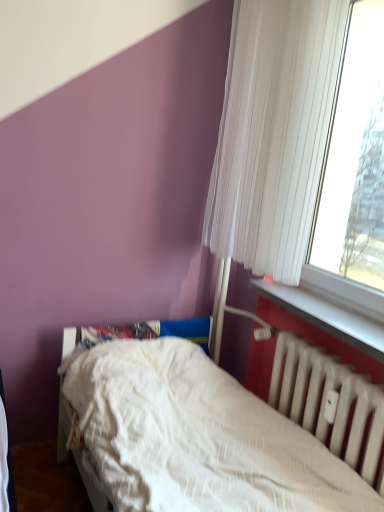
What do you see at coordinates (273, 132) in the screenshot? I see `white pleated curtain at upper right` at bounding box center [273, 132].

The image size is (384, 512). Describe the element at coordinates (221, 432) in the screenshot. I see `white textured bed at lower center` at that location.

This screenshot has height=512, width=384. What are the coordinates of `white pleated curtain at upper right` in the screenshot? It's located at (273, 132).

Consider the image. Does white plastic window sill at lower right have a larger size compared to white textured bed at lower center?

No, white plastic window sill at lower right is not bigger than white textured bed at lower center.

From a real-world perspective, is white plastic window sill at lower right over white textured bed at lower center?

Yes.

Between white plastic window sill at lower right and white textured bed at lower center, which one has smaller width?

With smaller width is white plastic window sill at lower right.

Considering the positions of point (355, 321) and point (235, 406), is point (355, 321) closer or farther from the camera than point (235, 406)?

Point (355, 321) is closer to the camera than point (235, 406).

From their relative heights in the image, would you say white pleated curtain at upper right is taller or shorter than white matte radiator at lower right?

white pleated curtain at upper right is taller than white matte radiator at lower right.

From the image's perspective, which is below, white pleated curtain at upper right or white matte radiator at lower right?

white matte radiator at lower right appears lower in the image.

Is white pleated curtain at upper right beside white matte radiator at lower right?

No, white pleated curtain at upper right is not next to white matte radiator at lower right.

Is white pleated curtain at upper right to the right of white matte radiator at lower right from the viewer's perspective?

No, white pleated curtain at upper right is not to the right of white matte radiator at lower right.

Does white matte radiator at lower right turn towards white textured bed at lower center?

Yes, white matte radiator at lower right is turned towards white textured bed at lower center.

Is point (275, 348) farther from camera compared to point (322, 455)?

Yes, point (275, 348) is behind point (322, 455).

Is white matte radiator at lower right to the left or to the right of white textured bed at lower center in the image?

white matte radiator at lower right is positioned on white textured bed at lower center's right side.

Considering the positions of point (179, 416) and point (269, 34), is point (179, 416) closer or farther from the camera than point (269, 34)?

Clearly, point (179, 416) is closer to the camera than point (269, 34).

Is white textured bed at lower center oriented towards white pleated curtain at upper right?

No.

Is white textured bed at lower center positioned behind white pleated curtain at upper right?

No, white textured bed at lower center is closer to the viewer.

From the image's perspective, which object appears higher, white textured bed at lower center or white pleated curtain at upper right?

white pleated curtain at upper right, from the image's perspective.

Who is more distant, white matte radiator at lower right or white pleated curtain at upper right?

white pleated curtain at upper right is more distant.

Is white matte radiator at lower right oriented towards white pleated curtain at upper right?

No.

From a real-world perspective, is white matte radiator at lower right beneath white pleated curtain at upper right?

Indeed, from a real-world perspective, white matte radiator at lower right is positioned beneath white pleated curtain at upper right.

Considering the sizes of objects white matte radiator at lower right and white pleated curtain at upper right in the image provided, who is taller, white matte radiator at lower right or white pleated curtain at upper right?

white pleated curtain at upper right.

Between white plastic window sill at lower right and white pleated curtain at upper right, which one has smaller width?

Thinner between the two is white plastic window sill at lower right.

Which object is more forward, white plastic window sill at lower right or white pleated curtain at upper right?

white plastic window sill at lower right is closer to the camera.

Could white pleated curtain at upper right be considered to be inside white plastic window sill at lower right?

No, white pleated curtain at upper right is not surrounded by white plastic window sill at lower right.

The image size is (384, 512). What are the coordinates of `curtain behind the white plastic window sill at lower right` in the screenshot? It's located at (273, 132).

Locate an element on the screen. This screenshot has height=512, width=384. radiator located underneath the white plastic window sill at lower right (from a real-world perspective) is located at coordinates (330, 403).

Are white plastic window sill at lower right and white matte radiator at lower right making contact?

white plastic window sill at lower right is not next to white matte radiator at lower right, and they're not touching.

Can you confirm if white plastic window sill at lower right is thinner than white matte radiator at lower right?

In fact, white plastic window sill at lower right might be wider than white matte radiator at lower right.

Consider the image. Is white plastic window sill at lower right to the right of white matte radiator at lower right from the viewer's perspective?

Yes, white plastic window sill at lower right is to the right of white matte radiator at lower right.

There is a white textured bed at lower center. Where is `window sill above it (from a real-world perspective)`? This screenshot has height=512, width=384. window sill above it (from a real-world perspective) is located at coordinates (326, 315).

Locate an element on the screen. radiator below the white pleated curtain at upper right (from the image's perspective) is located at coordinates (330, 403).

From the image, which object appears to be farther from white textured bed at lower center, white pleated curtain at upper right or white plastic window sill at lower right?

white pleated curtain at upper right is positioned further to the anchor white textured bed at lower center.

Estimate the real-world distances between objects in this image. Which object is further from white plastic window sill at lower right, white textured bed at lower center or white matte radiator at lower right?

Among the two, white textured bed at lower center is located further to white plastic window sill at lower right.

From the picture: When comparing their distances from white pleated curtain at upper right, does white plastic window sill at lower right or white matte radiator at lower right seem further?

Among the two, white matte radiator at lower right is located further to white pleated curtain at upper right.

Which object lies nearer to the anchor point white matte radiator at lower right, white textured bed at lower center or white pleated curtain at upper right?

Based on the image, white textured bed at lower center appears to be nearer to white matte radiator at lower right.

When comparing their distances from white textured bed at lower center, does white pleated curtain at upper right or white matte radiator at lower right seem further?

white pleated curtain at upper right is further to white textured bed at lower center.

From the picture: When comparing their distances from white textured bed at lower center, does white plastic window sill at lower right or white matte radiator at lower right seem further?

white plastic window sill at lower right is further to white textured bed at lower center.

Based on their spatial positions, is white pleated curtain at upper right or white plastic window sill at lower right further from white matte radiator at lower right?

white pleated curtain at upper right is positioned further to the anchor white matte radiator at lower right.

From the image, which object appears to be nearer to white pleated curtain at upper right, white matte radiator at lower right or white plastic window sill at lower right?

white plastic window sill at lower right is positioned closer to the anchor white pleated curtain at upper right.

The height and width of the screenshot is (512, 384). In order to click on window sill that lies between white pleated curtain at upper right and white matte radiator at lower right from top to bottom in this screenshot , I will do `click(326, 315)`.

Where is `radiator that lies between white pleated curtain at upper right and white textured bed at lower center from top to bottom`? This screenshot has width=384, height=512. radiator that lies between white pleated curtain at upper right and white textured bed at lower center from top to bottom is located at coordinates coord(330,403).

The image size is (384, 512). I want to click on window sill between white pleated curtain at upper right and white textured bed at lower center from top to bottom, so click(x=326, y=315).

Identify the location of radiator between white textured bed at lower center and white plastic window sill at lower right in the front-back direction. (330, 403).